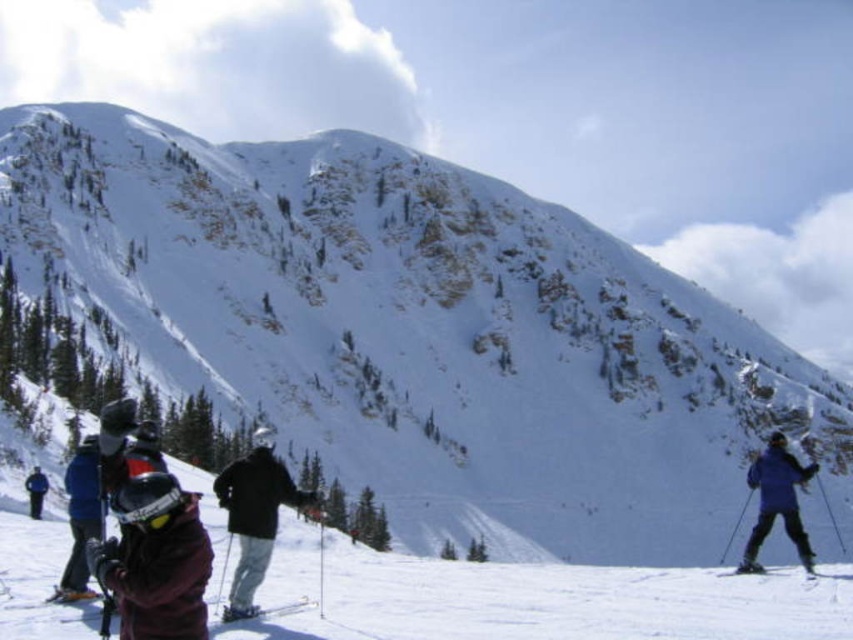
Which is more to the left, purple matte jacket at lower right or metallic silver ski at lower center?

From the viewer's perspective, metallic silver ski at lower center appears more on the left side.

Based on the photo, can you confirm if purple matte jacket at lower right is positioned to the left of metallic silver ski at lower center?

No, purple matte jacket at lower right is not to the left of metallic silver ski at lower center.

Who is more forward, [804,548] or [286,605]?

Point [286,605]

You are a GUI agent. You are given a task and a screenshot of the screen. Output one action in this format:
    pyautogui.click(x=<x>, y=<y>)
    Task: Click on the purple matte jacket at lower right
    This screenshot has width=853, height=640.
    Given the screenshot: What is the action you would take?
    pyautogui.click(x=776, y=500)

How far apart are snowy rocky mountain at center and dark brown jacket at lower left?

snowy rocky mountain at center is 401.32 feet away from dark brown jacket at lower left.

Which is in front, point (387, 248) or point (160, 531)?

Point (160, 531) is more forward.

Does point (350, 180) lie behind point (149, 561)?

Yes.

Identify the location of snowy rocky mountain at center. The image size is (853, 640). (421, 332).

Who is positioned more to the left, blue fabric jacket at lower left or metallic silver ski at lower center?

blue fabric jacket at lower left

Between point (97, 536) and point (291, 605), which one is positioned behind?

Point (291, 605)

What do you see at coordinates (80, 516) in the screenshot?
I see `blue fabric jacket at lower left` at bounding box center [80, 516].

Identify the location of blue fabric jacket at lower left. Image resolution: width=853 pixels, height=640 pixels. (80, 516).